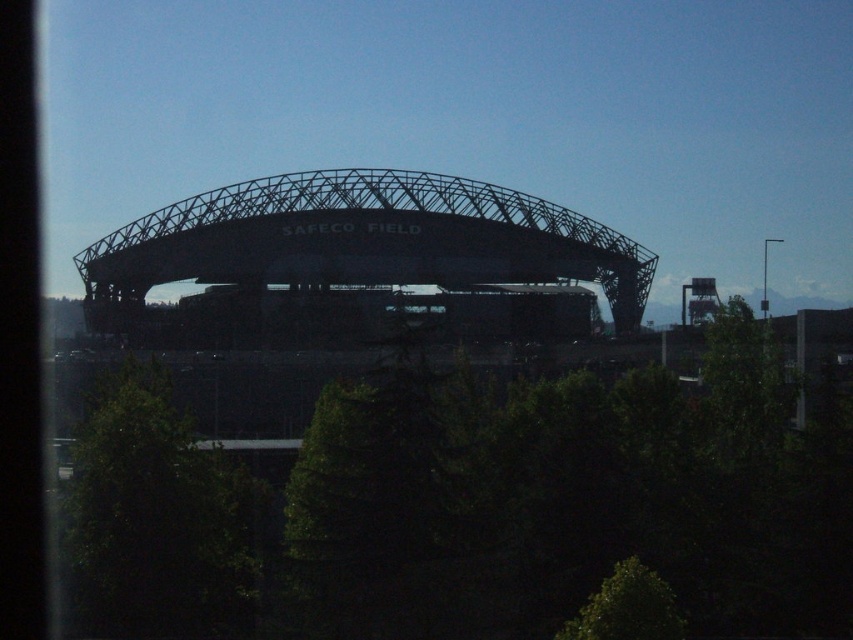
Question: Considering the real-world distances, which object is farthest from the green leafy tree at center?

Choices:
 (A) green leafy tree at right
 (B) green leafy tree at lower left
 (C) green leafy tree at lower center

Answer: (B)

Question: Does green leafy tree at center appear under green leafy tree at right?

Choices:
 (A) no
 (B) yes

Answer: (B)

Question: Which object is farther from the camera taking this photo?

Choices:
 (A) green leafy tree at lower left
 (B) green leafy tree at center
 (C) green leafy tree at lower center
 (D) green leafy tree at right

Answer: (D)

Question: From the image, what is the correct spatial relationship of green leafy tree at center in relation to green leafy tree at lower left?

Choices:
 (A) below
 (B) above

Answer: (B)

Question: Is the position of green leafy tree at right less distant than that of green leafy tree at lower center?

Choices:
 (A) yes
 (B) no

Answer: (B)

Question: Which object is closer to the camera taking this photo?

Choices:
 (A) green leafy tree at lower center
 (B) green leafy tree at lower left
 (C) green leafy tree at center

Answer: (C)